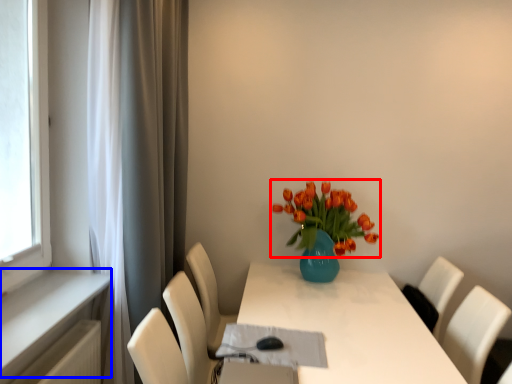
Question: Among these objects, which one is farthest to the camera, flower (highlighted by a red box) or window sill (highlighted by a blue box)?

Choices:
 (A) flower
 (B) window sill

Answer: (A)